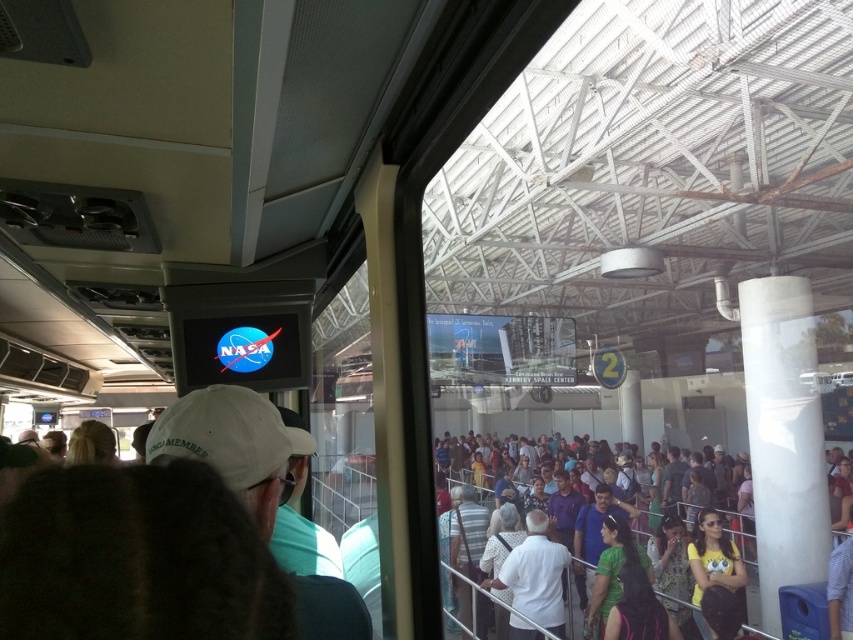
You are standing at the point marked as point [474,538] in the bus. The bus has a length of 35 feet. If you want to walk to the front of the bus, will you have enough space to move freely?

The distance between point [474,538] and the camera is 24.15 feet. Since the bus is 35 feet long, there is sufficient space to move freely towards the front.

You are a passenger on the bus and notice two people outside the window. One is wearing a white fabric cap at center and the other has multicolored casual attire at center. Which clothing item is positioned higher on their body?

The white fabric cap at center is located above multicolored casual attire at center, so the white fabric cap at center is positioned higher on their body.